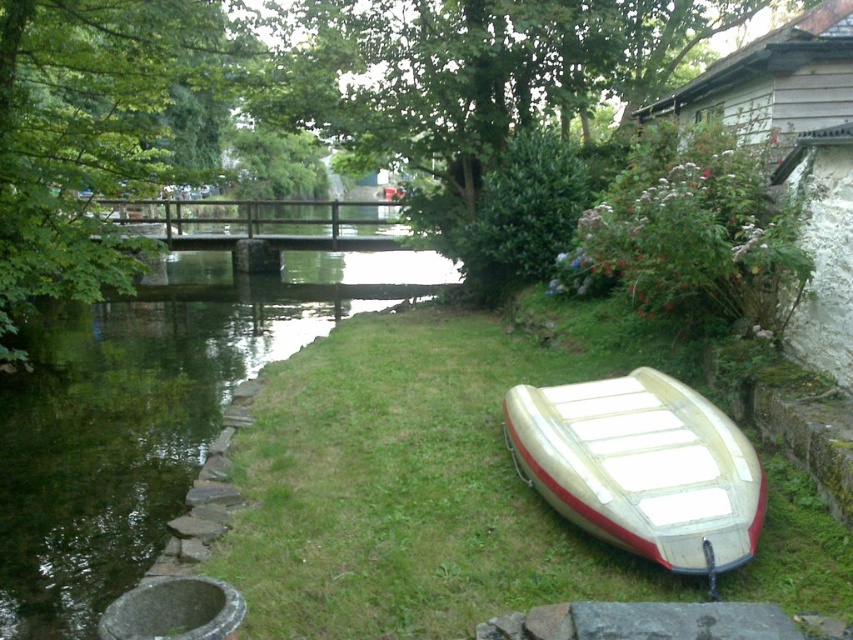
Does point (241, 225) lie in front of point (572, 424)?

No, it is not.

This screenshot has width=853, height=640. What do you see at coordinates (148, 413) in the screenshot? I see `green grassy river at left` at bounding box center [148, 413].

Find the location of `green grassy river at left`. green grassy river at left is located at coordinates (148, 413).

Can you confirm if green grass at lower right is bigger than white matte boat at lower right?

Yes.

Does point (543, 554) lie in front of point (650, 392)?

That is True.

Locate an element on the screen. The image size is (853, 640). green grass at lower right is located at coordinates (409, 486).

Locate an element on the screen. green grass at lower right is located at coordinates (409, 486).

Is green grass at lower right further to camera compared to green grassy river at left?

No, it is not.

Is point (299, 531) less distant than point (90, 332)?

Yes.

Between point (225, 536) and point (73, 458), which one is positioned in front?

Point (225, 536) is more forward.

I want to click on green grass at lower right, so click(409, 486).